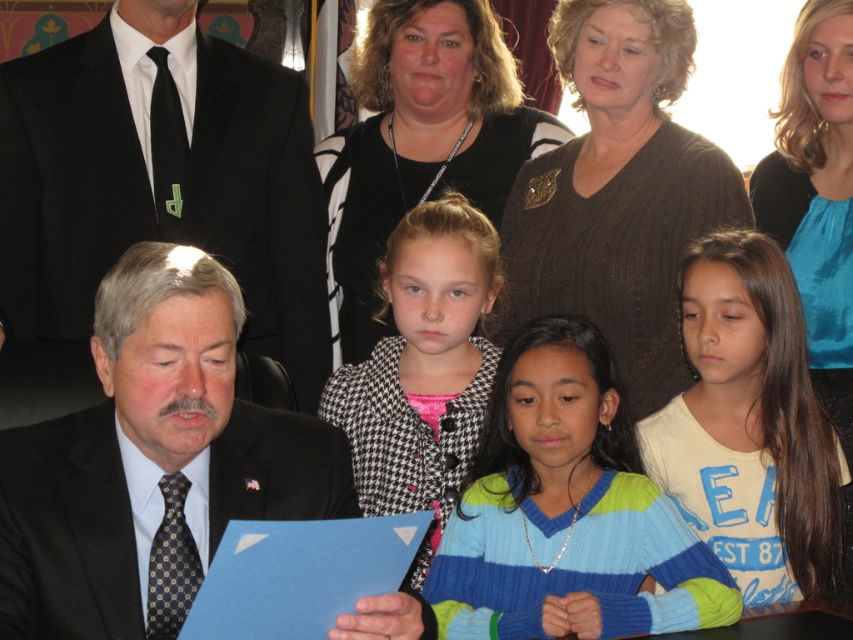
Is black and white sweater at upper center bigger than blue silk blouse at upper right?

Yes.

Is point (550, 125) more distant than point (849, 403)?

Yes, it is.

Who is more distant from viewer, (397,0) or (828,339)?

The point (397,0) is behind.

I want to click on black and white sweater at upper center, so click(419, 141).

Is brown knitted sweater at upper center shorter than white cotton shirt at lower right?

No, brown knitted sweater at upper center is not shorter than white cotton shirt at lower right.

Can you confirm if brown knitted sweater at upper center is positioned to the right of white cotton shirt at lower right?

In fact, brown knitted sweater at upper center is to the left of white cotton shirt at lower right.

Does point (624, 189) come closer to viewer compared to point (675, 435)?

That is False.

This screenshot has height=640, width=853. Identify the location of brown knitted sweater at upper center. (618, 193).

Between black suit at upper left and white cotton shirt at lower right, which one is positioned higher?

black suit at upper left is higher up.

Which is behind, point (258, 257) or point (769, 272)?

Positioned behind is point (258, 257).

At what (x,y) coordinates should I click in order to perform the action: click on black suit at upper left. Please return your answer as a coordinate pair (x, y). The width and height of the screenshot is (853, 640). Looking at the image, I should click on (161, 182).